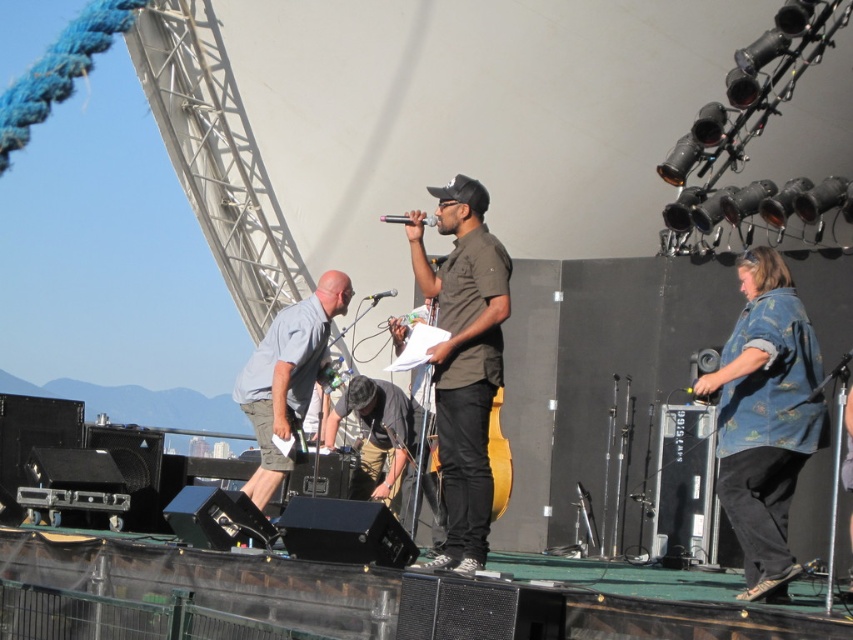
Question: Does floral denim shirt at right have a larger size compared to black matte microphone at center?

Choices:
 (A) no
 (B) yes

Answer: (B)

Question: Which point appears farthest from the camera in this image?

Choices:
 (A) (386, 220)
 (B) (450, 289)

Answer: (B)

Question: In this image, where is dark gray fabric at center located relative to black matte microphone at center?

Choices:
 (A) right
 (B) left

Answer: (A)

Question: Among these points, which one is nearest to the camera?

Choices:
 (A) coord(776,564)
 (B) coord(450,305)
 (C) coord(384,404)

Answer: (A)

Question: Which object is farther from the camera taking this photo?

Choices:
 (A) gray fabric shirt at center
 (B) dark brown shirt at center
 (C) black plastic microphone at center

Answer: (A)

Question: Is floral denim shirt at right closer to the viewer compared to dark brown shirt at center?

Choices:
 (A) no
 (B) yes

Answer: (B)